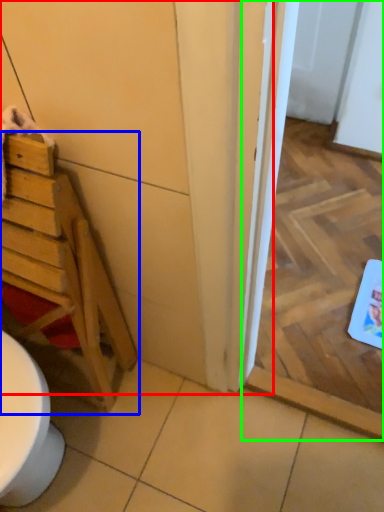
Question: Estimate the real-world distances between objects in this image. Which object is closer to door (highlighted by a red box), furniture (highlighted by a blue box) or screen door (highlighted by a green box)?

Choices:
 (A) furniture
 (B) screen door

Answer: (A)